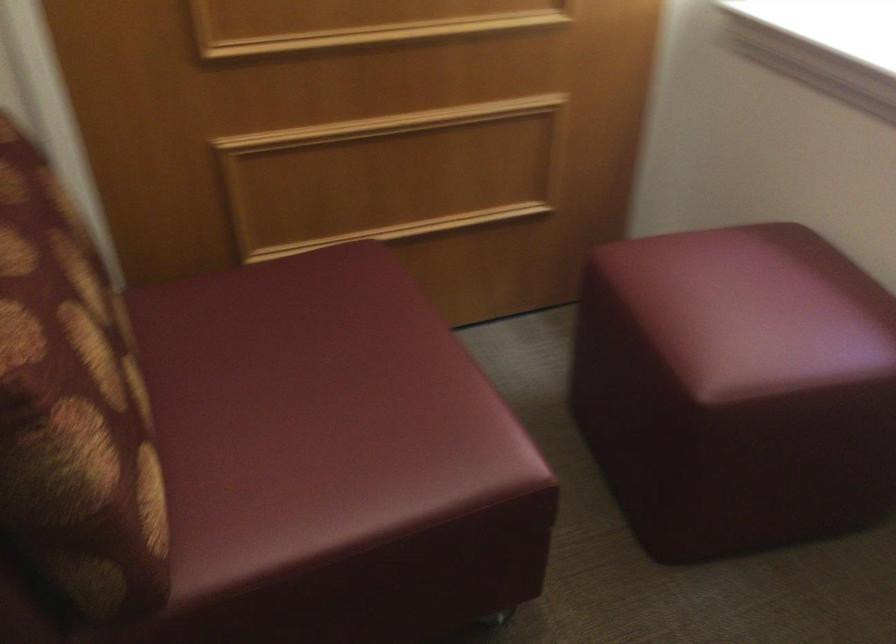
Find where to lift the patterned pillow. Please return your answer as a coordinate pair (x, y).

(72, 406)